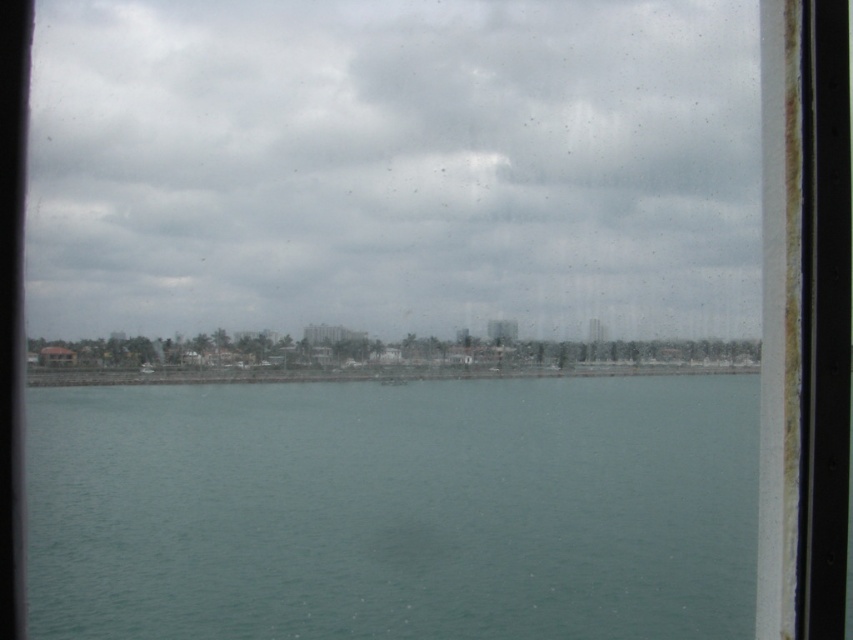
Identify the location of cloudy sky at upper center. This screenshot has height=640, width=853. (393, 166).

Does cloudy sky at upper center appear on the right side of teal smooth water at center?

Correct, you'll find cloudy sky at upper center to the right of teal smooth water at center.

The width and height of the screenshot is (853, 640). I want to click on cloudy sky at upper center, so click(x=393, y=166).